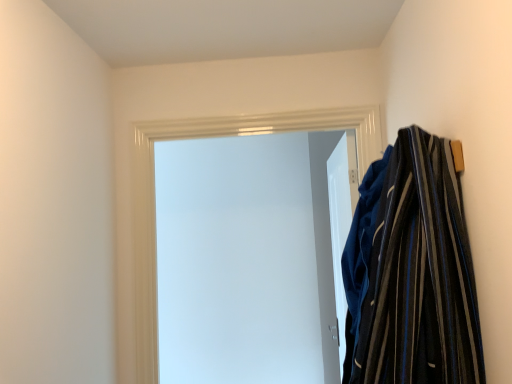
Locate an element on the screen. white matte door at upper center is located at coordinates pos(214,136).

Describe the element at coordinates (214, 136) in the screenshot. This screenshot has width=512, height=384. I see `white matte door at upper center` at that location.

I want to click on white matte door at upper center, so click(214, 136).